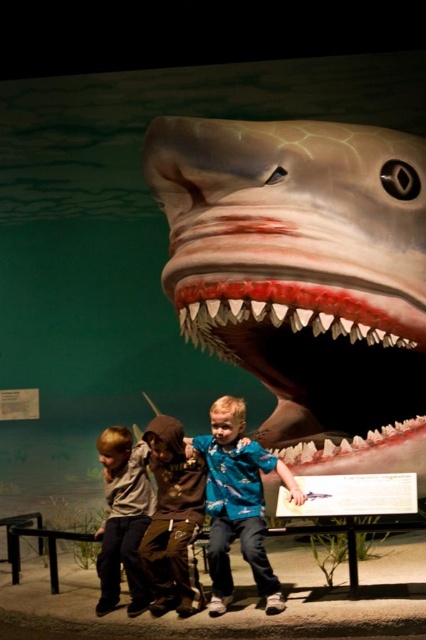
You are a tour guide leading a group of children through the museum. You want to point out two specific points on the shark model to explain its features. The first point is at coordinates point (331, 301) and the second is at point (147, 566). Which of these points is closer to the children sitting on the bench?

Point (331, 301) is in front of point (147, 566), so the first point is closer to the children sitting on the bench.

You are a parent standing in front of the smooth gray shark at center and the brown cotton hoodie at center. Which object is closer to you?

The smooth gray shark at center is closer to you than the brown cotton hoodie at center.